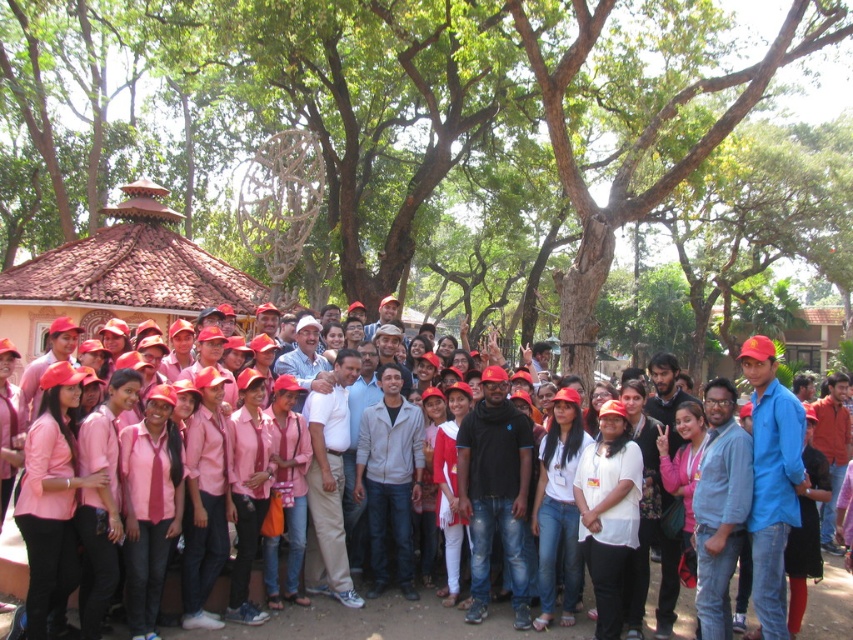
You are standing at point (846, 593) and want to walk to point (352, 134). Given that the path between them is clear, will you be moving towards the pavilion or away from it?

Since point (352, 134) is behind point (846, 593), moving from point (846, 593) to point (352, 134) would mean moving away from the pavilion in the background.

You are a photographer trying to capture a group photo of the pink fabric shirt at center and the green leafy tree at center. Which object will appear larger in the photo?

The green leafy tree at center will appear larger in the photo because it is bigger than the pink fabric shirt at center.

You are a photographer trying to capture a group photo of the pink fabric shirt at center and the green leafy tree at center. Since the tree is much taller than the shirt, how should you position your camera to ensure both are fully visible in the frame?

The green leafy tree at center is much taller than the pink fabric shirt at center. To capture both fully in the frame, position the camera lower to include the entire tree while keeping the shirt in focus.